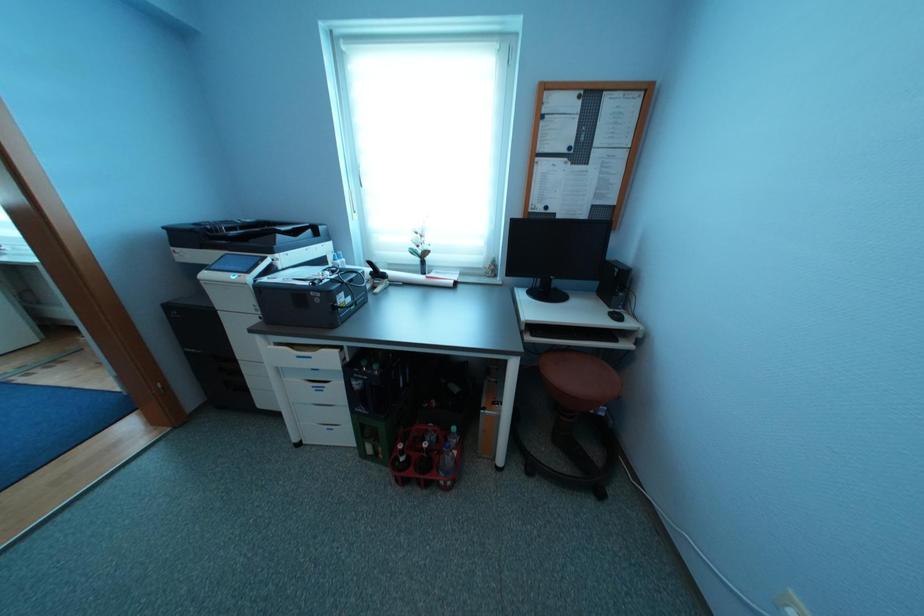
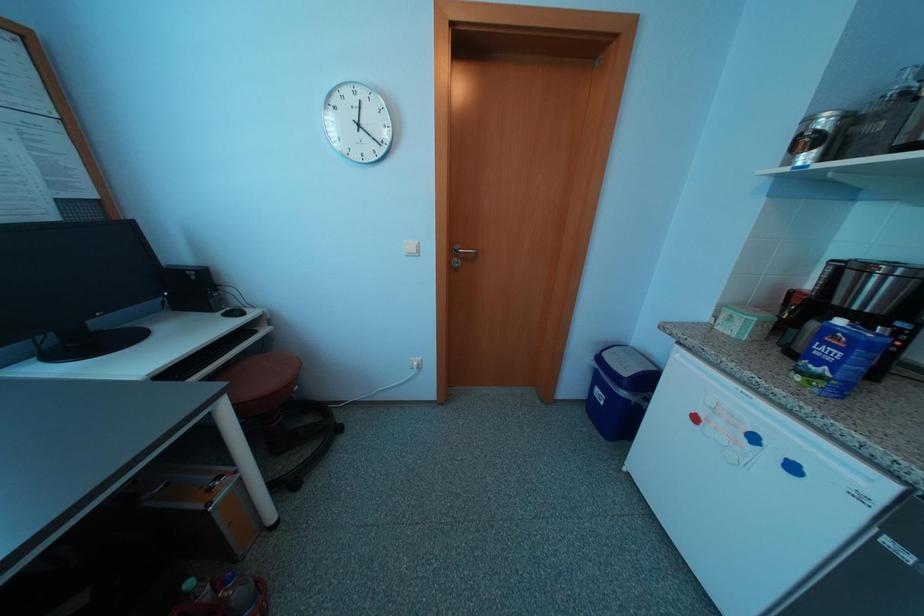
The first image is from the beginning of the video and the second image is from the end. How did the camera likely rotate when shooting the video?

The camera's rotation is toward right-down.